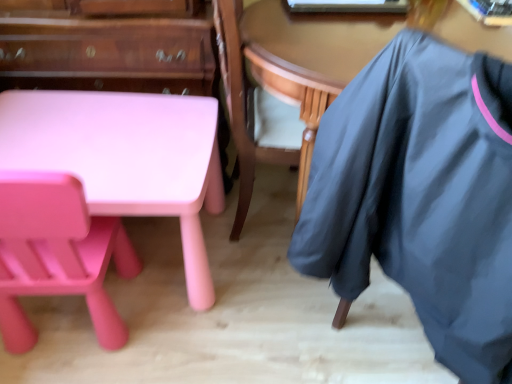
You are a GUI agent. You are given a task and a screenshot of the screen. Output one action in this format:
    pyautogui.click(x=<x>, y=<y>)
    Task: Click on the vacant area that lies to the right of matte pink chair at lower left
    The image size is (512, 384).
    Given the screenshot: What is the action you would take?
    pyautogui.click(x=191, y=332)